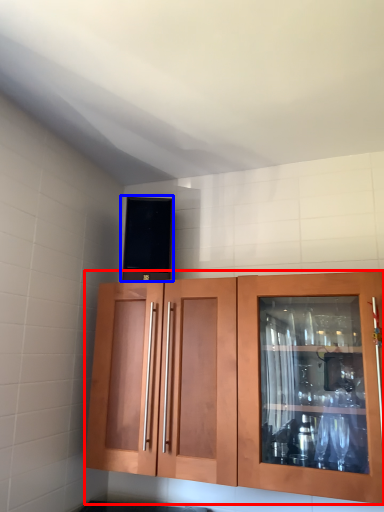
Question: Which point is further to the camera, cabinetry (highlighted by a red box) or appliance (highlighted by a blue box)?

Choices:
 (A) cabinetry
 (B) appliance

Answer: (B)